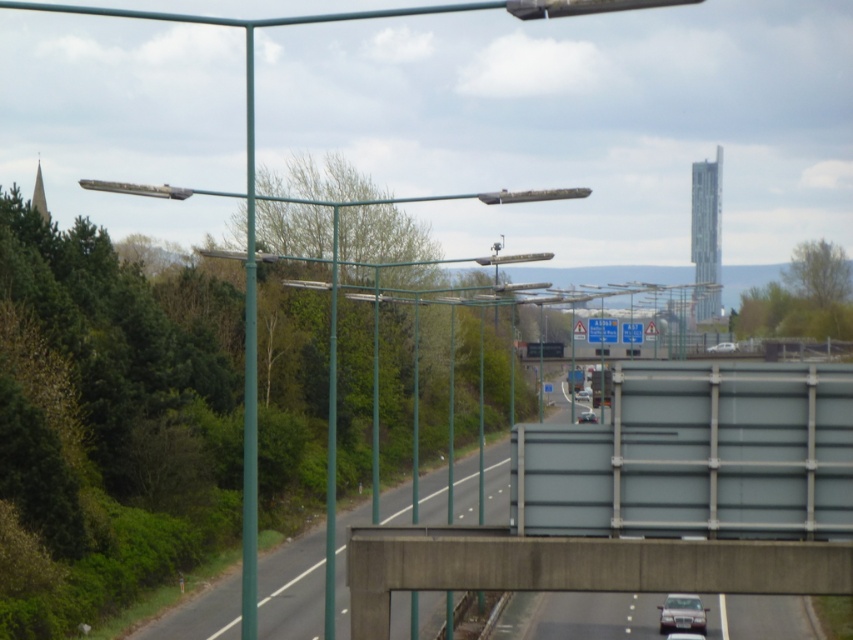
Question: Is metallic silver car at center below silver metallic sedan at center?

Choices:
 (A) no
 (B) yes

Answer: (A)

Question: Which of the following is the closest to the observer?

Choices:
 (A) (688, 618)
 (B) (247, 45)
 (C) (579, 419)
 (D) (712, 352)

Answer: (A)

Question: Which object is the closest to the metallic silver car at center?

Choices:
 (A) white glossy car at center
 (B) blue plastic sign at center
 (C) silver metallic sedan at center

Answer: (B)

Question: Is white glossy car at center below metallic silver car at center?

Choices:
 (A) yes
 (B) no

Answer: (B)

Question: Can you confirm if blue plastic sign at center is positioned to the right of white glossy car at center?

Choices:
 (A) no
 (B) yes

Answer: (A)

Question: Which point appears closest to the camera in this image?

Choices:
 (A) (596, 324)
 (B) (579, 413)
 (C) (579, 392)

Answer: (A)